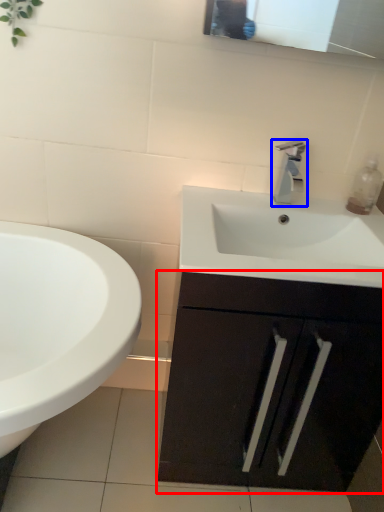
Question: Which object appears closest to the camera in this image, bathroom cabinet (highlighted by a red box) or tap (highlighted by a blue box)?

Choices:
 (A) bathroom cabinet
 (B) tap

Answer: (A)